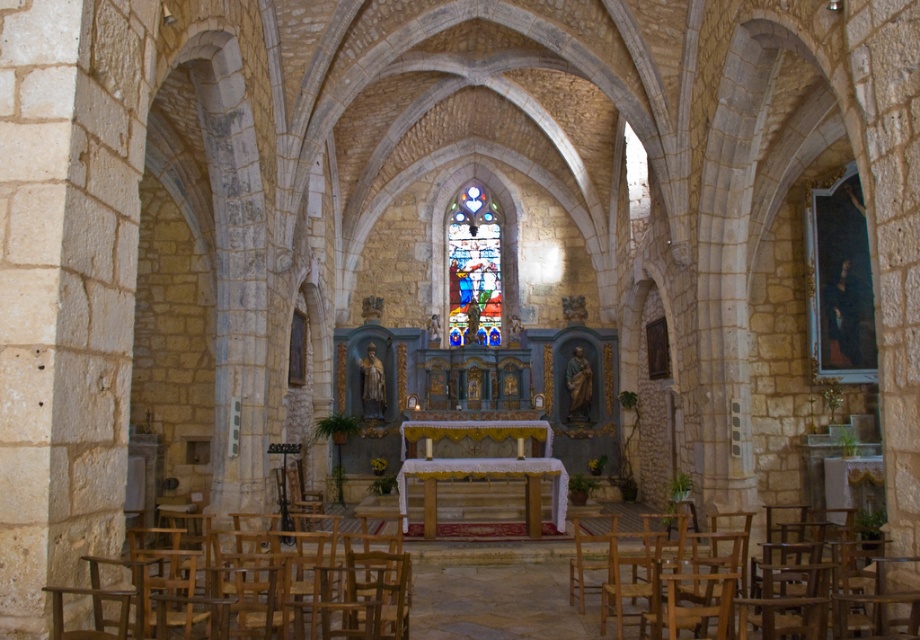
Is wooden chair at lower left in front of stained glass window at center?

Yes.

Which is in front, point (236, 595) or point (475, 276)?

Positioned in front is point (236, 595).

In order to click on wooden chair at lower left in this screenshot , I will do pyautogui.click(x=311, y=595).

Between point (456, 324) and point (913, 627), which one is positioned in front?

Positioned in front is point (913, 627).

Can you confirm if stained glass window at center is wider than light brown wood chair at lower center?

Incorrect, stained glass window at center's width does not surpass light brown wood chair at lower center's.

Where is `stained glass window at center`? The image size is (920, 640). stained glass window at center is located at coordinates (474, 268).

Who is positioned more to the left, wooden chair at lower left or light brown wood chair at lower center?

wooden chair at lower left is more to the left.

Based on the photo, can you confirm if wooden chair at lower left is smaller than light brown wood chair at lower center?

Correct, wooden chair at lower left occupies less space than light brown wood chair at lower center.

Between point (286, 557) and point (639, 522), which one is positioned in front?

Positioned in front is point (286, 557).

Image resolution: width=920 pixels, height=640 pixels. In order to click on wooden chair at lower left in this screenshot , I will do `click(311, 595)`.